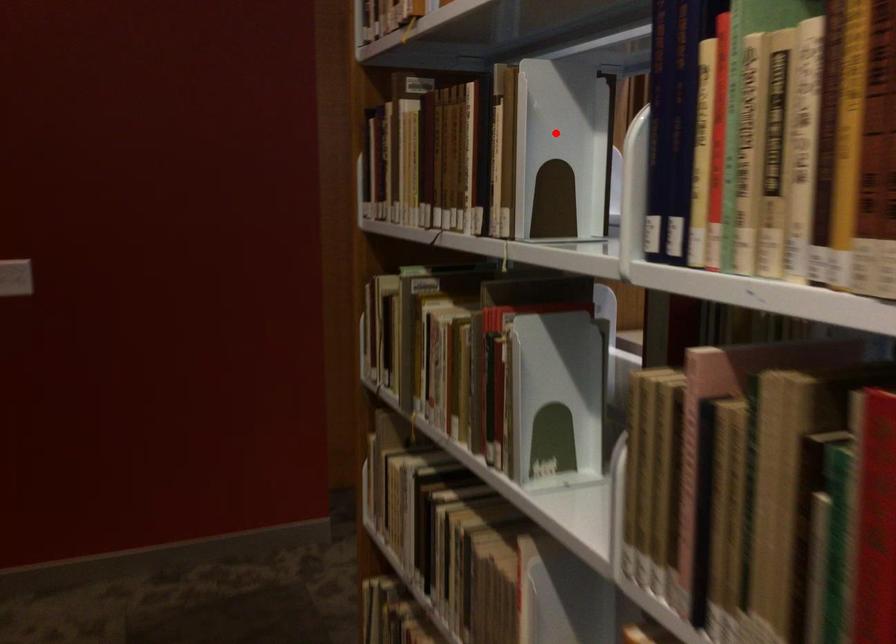
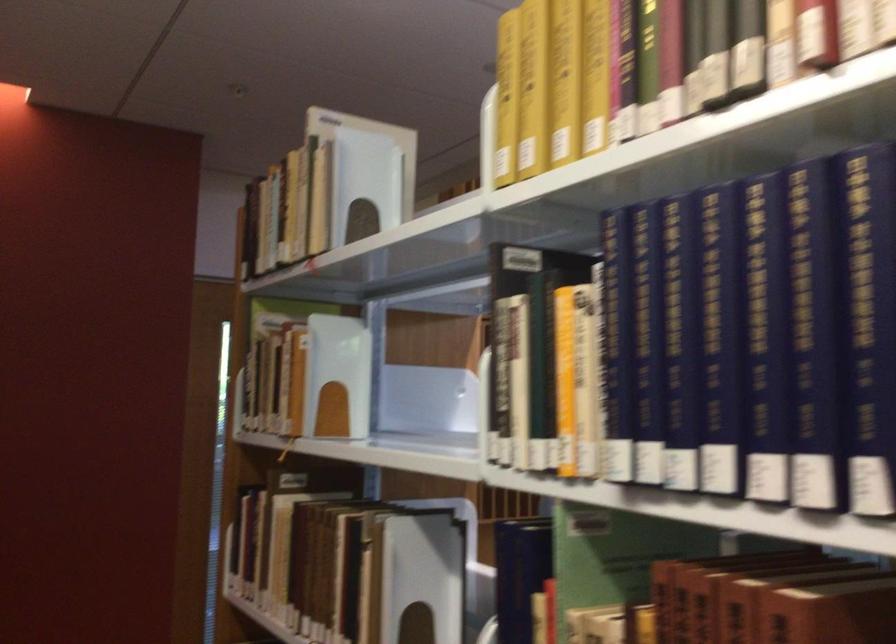
Locate, in the second image, the point that corresponds to the highlighted location in the first image.

(417, 581)